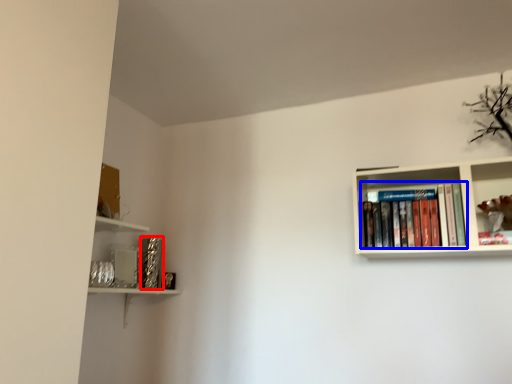
Question: Among these objects, which one is farthest to the camera, paperback book (highlighted by a red box) or book (highlighted by a blue box)?

Choices:
 (A) paperback book
 (B) book

Answer: (A)